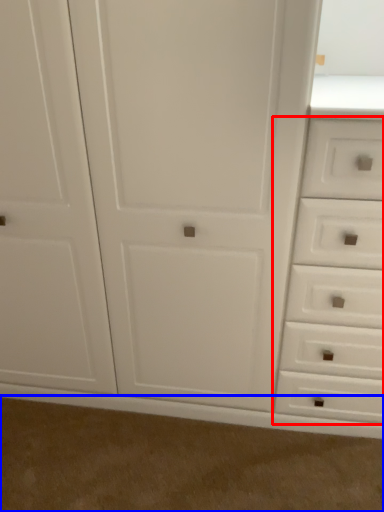
Question: Which of the following is the closest to the observer, drawer (highlighted by a red box) or plain (highlighted by a blue box)?

Choices:
 (A) drawer
 (B) plain

Answer: (A)